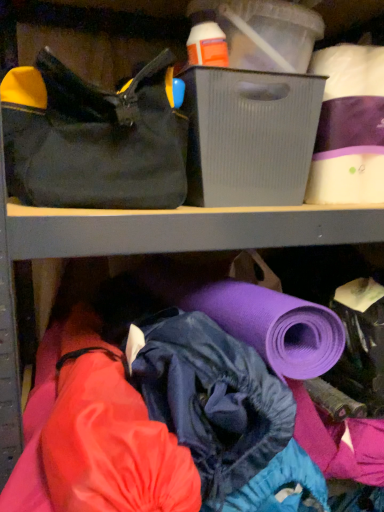
Question: From a real-world perspective, is gray ribbed plastic storage box at upper center above or below black canvas handbag at upper left?

Choices:
 (A) above
 (B) below

Answer: (B)

Question: Is gray ribbed plastic storage box at upper center wider or thinner than black canvas handbag at upper left?

Choices:
 (A) thin
 (B) wide

Answer: (A)

Question: Which of these objects is positioned farthest from the black canvas handbag at upper left?

Choices:
 (A) gray ribbed plastic storage box at upper center
 (B) white matte toilet paper at upper right

Answer: (B)

Question: Which of these objects is positioned closest to the gray ribbed plastic storage box at upper center?

Choices:
 (A) white matte toilet paper at upper right
 (B) black canvas handbag at upper left

Answer: (B)